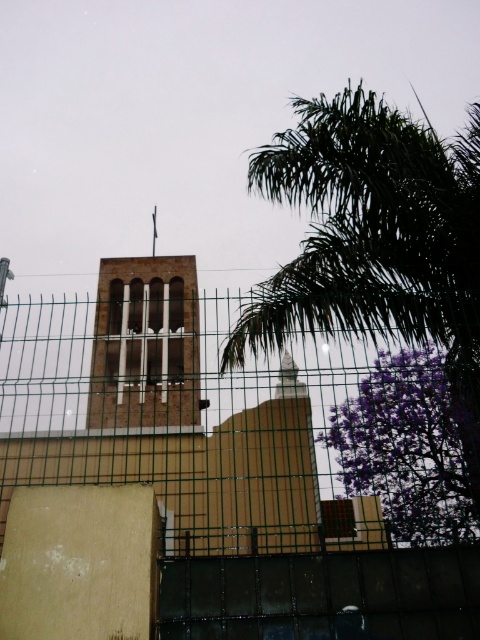
Question: Which point appears farthest from the camera in this image?

Choices:
 (A) (94, 352)
 (B) (427, 525)
 (C) (344, 440)
 (D) (69, 310)

Answer: (C)

Question: Which of the following is the farthest from the observer?

Choices:
 (A) purple leafy tree at right
 (B) brown brick bell tower at center
 (C) green wire mesh fence at center

Answer: (A)

Question: Does green wire mesh fence at center have a greater width compared to purple leafy tree at right?

Choices:
 (A) yes
 (B) no

Answer: (A)

Question: Which point is closer to the camera taking this photo?

Choices:
 (A) (419, 528)
 (B) (304, 147)
 (C) (24, 444)

Answer: (B)

Question: Can you confirm if green leafy palm tree at upper right is wider than purple leafy tree at right?

Choices:
 (A) yes
 (B) no

Answer: (A)

Question: Is green wire mesh fence at center closer to camera compared to purple leafy tree at right?

Choices:
 (A) yes
 (B) no

Answer: (A)